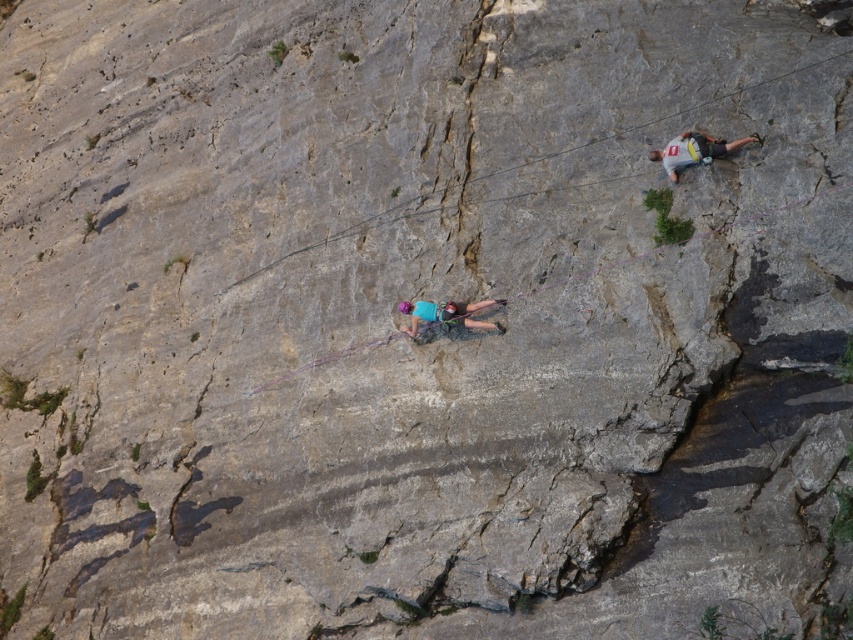
Question: Which object appears farthest from the camera in this image?

Choices:
 (A) matte purple helmet at center
 (B) gray fabric shirt at upper right

Answer: (A)

Question: Is matte purple helmet at center wider than gray fabric shirt at upper right?

Choices:
 (A) yes
 (B) no

Answer: (A)

Question: In this image, where is matte purple helmet at center located relative to gray fabric shirt at upper right?

Choices:
 (A) above
 (B) below

Answer: (B)

Question: Can you confirm if matte purple helmet at center is positioned above gray fabric shirt at upper right?

Choices:
 (A) no
 (B) yes

Answer: (A)

Question: Which point appears farthest from the camera in this image?

Choices:
 (A) (456, 323)
 (B) (740, 138)

Answer: (A)